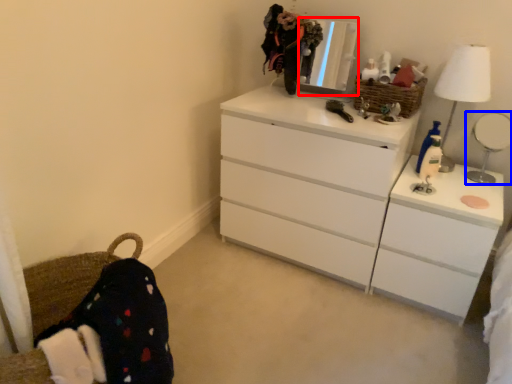
Question: Which of the following is the farthest to the observer, mirror (highlighted by a red box) or reflection (highlighted by a blue box)?

Choices:
 (A) mirror
 (B) reflection

Answer: (A)